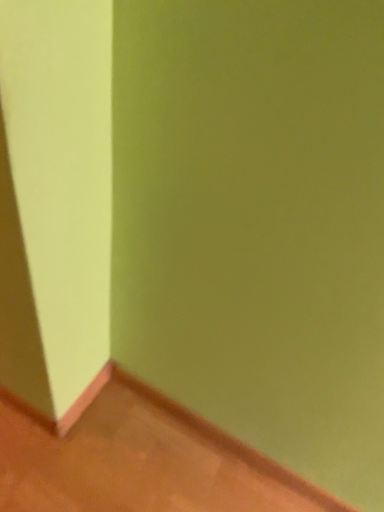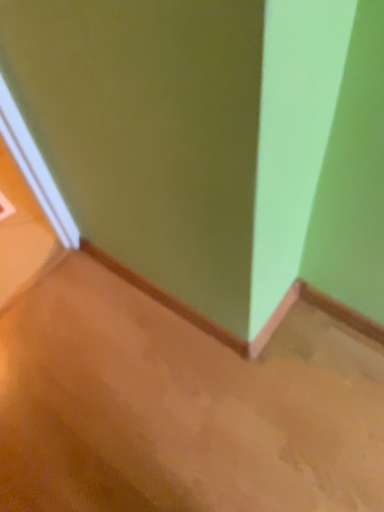
Question: How did the camera likely rotate when shooting the video?

Choices:
 (A) rotated downward
 (B) rotated upward

Answer: (A)